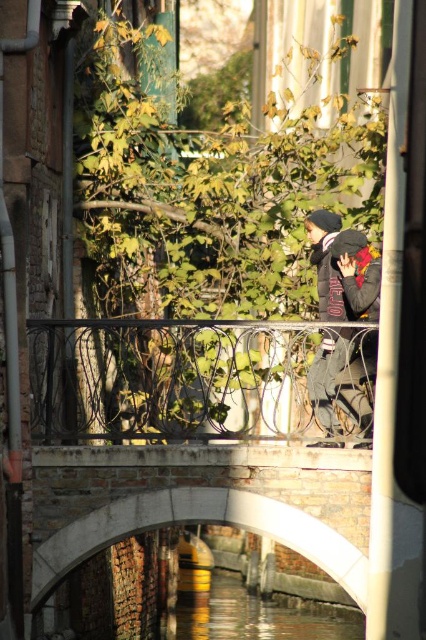
Question: Does concrete bridge at center appear under dark gray jacket at center?

Choices:
 (A) yes
 (B) no

Answer: (A)

Question: Does concrete bridge at center appear under dark gray jacket at center?

Choices:
 (A) no
 (B) yes

Answer: (B)

Question: Which object is positioned closest to the concrete bridge at center?

Choices:
 (A) dark gray jacket at center
 (B) clear water at canal center

Answer: (A)

Question: Which point is farther to the camera?

Choices:
 (A) (368, 282)
 (B) (184, 628)
 (C) (63, 497)

Answer: (B)

Question: Which object appears closest to the camera in this image?

Choices:
 (A) concrete bridge at center
 (B) dark gray jacket at center
 (C) clear water at canal center

Answer: (A)

Question: Is concrete bridge at center to the right of dark gray jacket at center from the viewer's perspective?

Choices:
 (A) yes
 (B) no

Answer: (B)